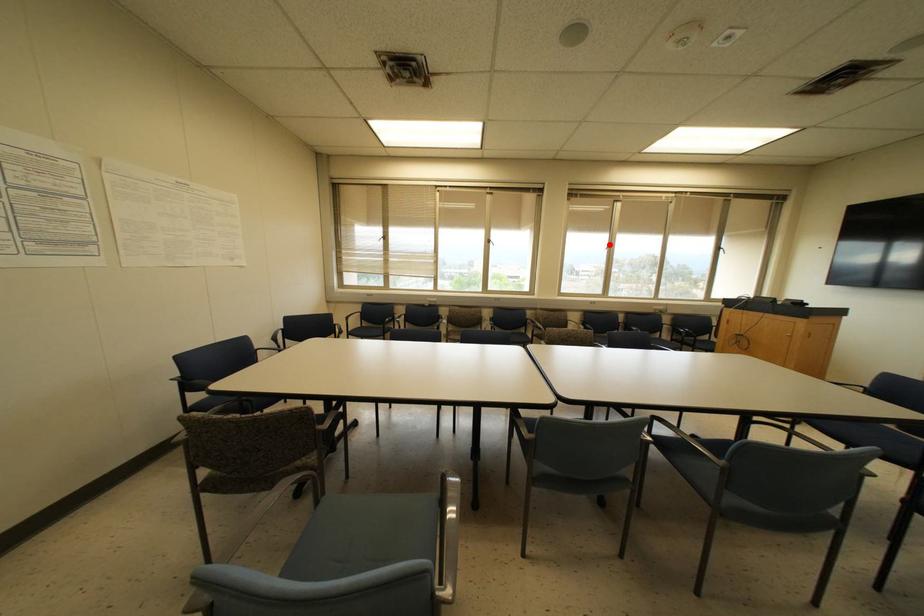
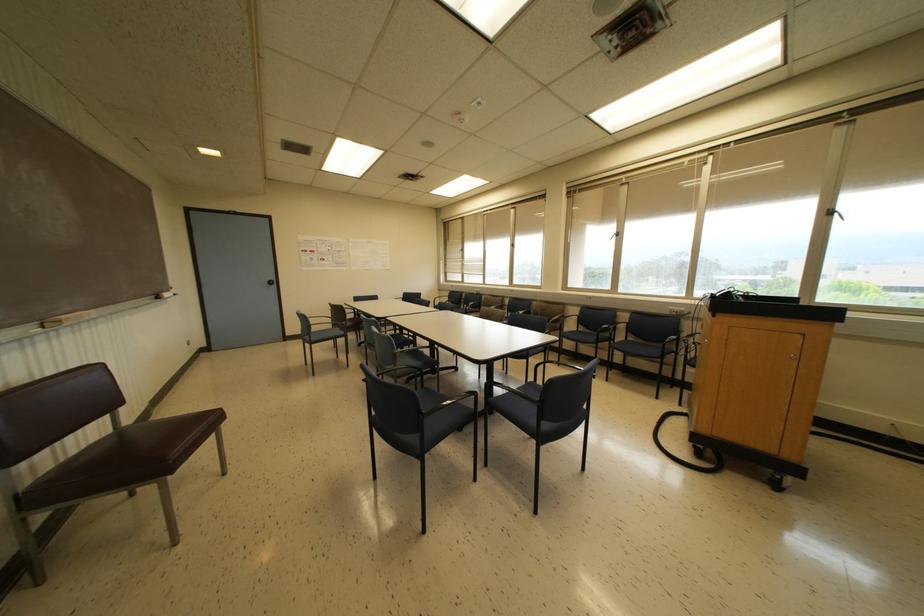
Where in the second image is the point corresponding to the highlighted location from the first image?

(617, 233)